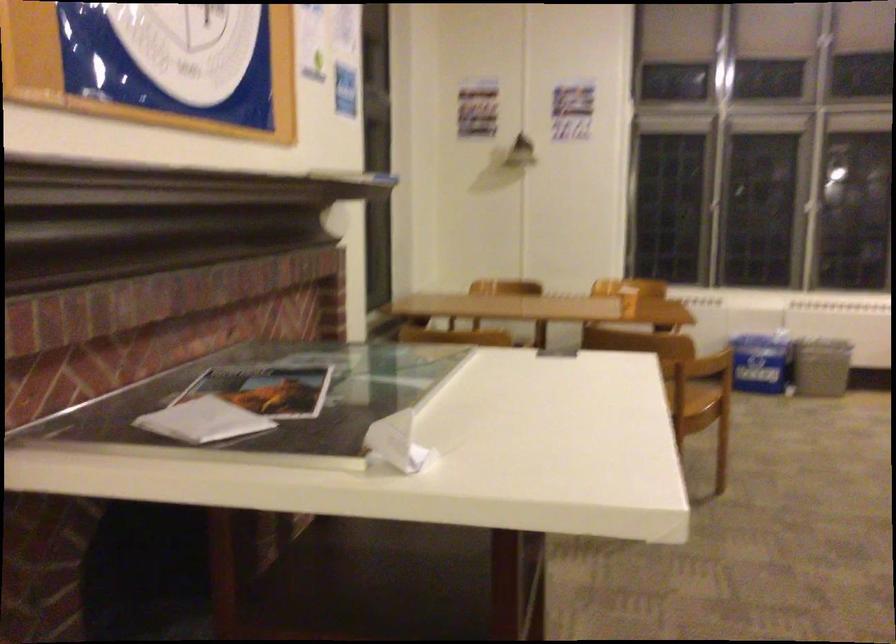
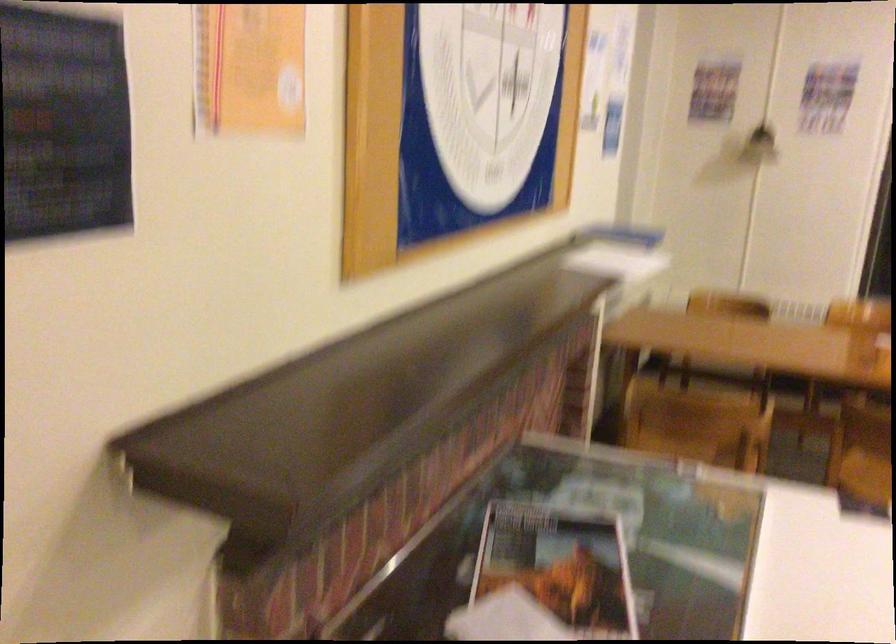
Question: The images are taken continuously from a first-person perspective. In which direction is your viewpoint rotating?

Choices:
 (A) Left
 (B) Right
 (C) Up
 (D) Down

Answer: (A)